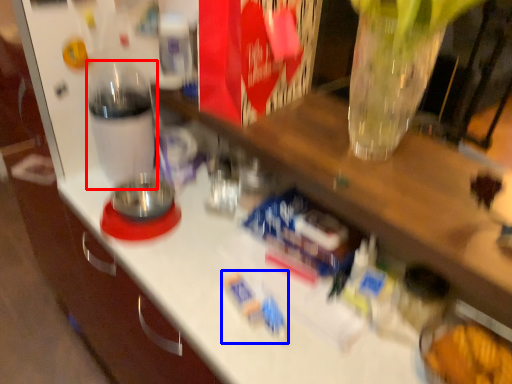
Question: Among these objects, which one is farthest to the camera, bottle (highlighted by a red box) or toy (highlighted by a blue box)?

Choices:
 (A) bottle
 (B) toy

Answer: (A)